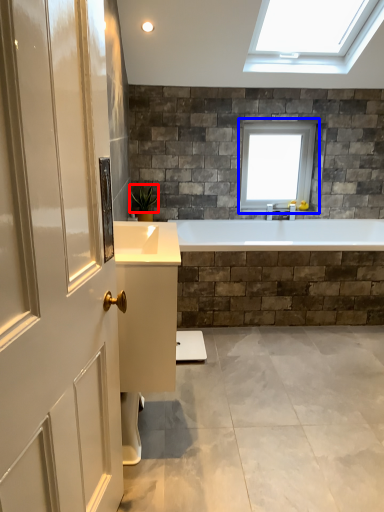
Question: Which object is closer to the camera taking this photo, plant (highlighted by a red box) or window (highlighted by a blue box)?

Choices:
 (A) plant
 (B) window

Answer: (A)